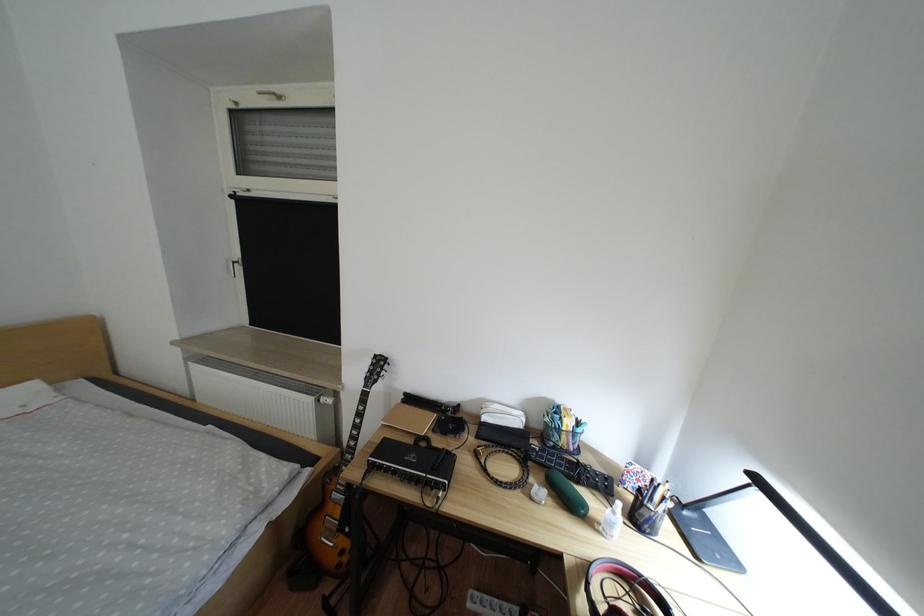
The image size is (924, 616). What are the coordinates of `black blind handle` in the screenshot? It's located at (237, 192).